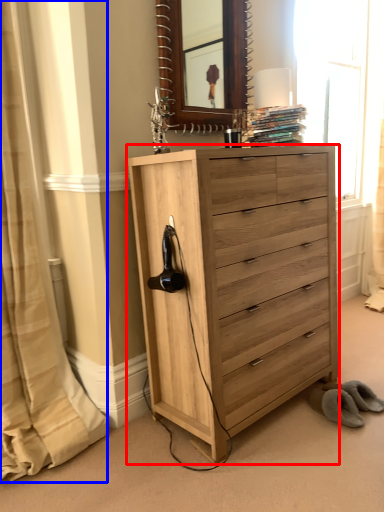
Question: Among these objects, which one is farthest to the camera, chest of drawers (highlighted by a red box) or curtain (highlighted by a blue box)?

Choices:
 (A) chest of drawers
 (B) curtain

Answer: (A)